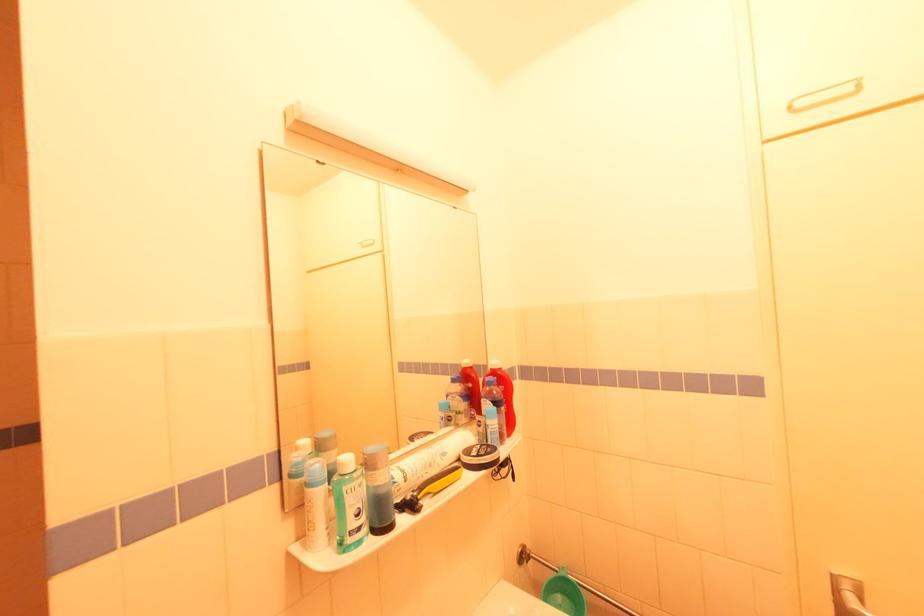
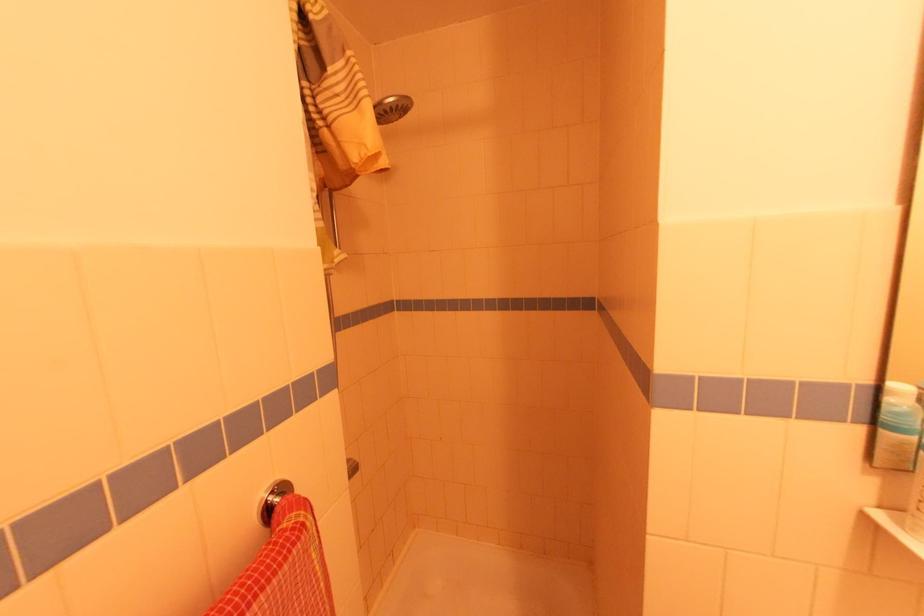
Find the pixel in the second image that matches the point at 304,485 in the first image.

(906, 445)